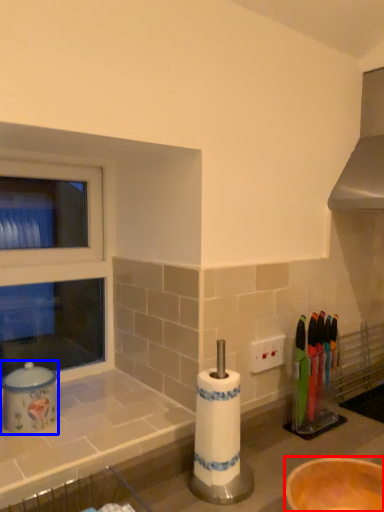
Question: Which of the following is the closest to the observer, bowl (highlighted by a red box) or appliance (highlighted by a blue box)?

Choices:
 (A) bowl
 (B) appliance

Answer: (A)